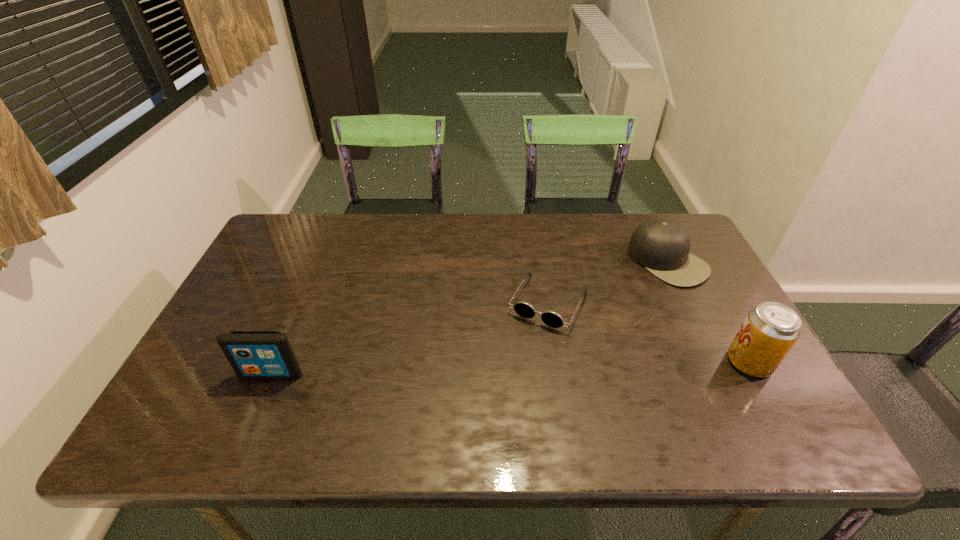
The width and height of the screenshot is (960, 540). Identify the location of the leftmost object. click(x=252, y=354).

The image size is (960, 540). In order to click on the second tallest object in this screenshot , I will do `click(252, 354)`.

Locate an element on the screen. This screenshot has width=960, height=540. pop (soda) is located at coordinates (770, 330).

In order to click on sunglasses in this screenshot , I will do `click(552, 319)`.

At what (x,y) coordinates should I click in order to perform the action: click on the second object from left to right. Please return your answer as a coordinate pair (x, y). This screenshot has height=540, width=960. Looking at the image, I should click on point(552,319).

Find the location of a particular element. This screenshot has width=960, height=540. the third tallest object is located at coordinates (662, 246).

You are a GUI agent. You are given a task and a screenshot of the screen. Output one action in this format:
    pyautogui.click(x=<x>, y=<y>)
    Task: Click on the vacant space located 0.060m on the front screen of the leftmost object
    Image resolution: width=960 pixels, height=540 pixels.
    Given the screenshot: What is the action you would take?
    pyautogui.click(x=259, y=403)

Locate an element on the screen. This screenshot has width=960, height=540. vacant space located 0.080m on the back of the pop (soda) is located at coordinates (727, 321).

Locate an element on the screen. Image resolution: width=960 pixels, height=540 pixels. blank space located on the front-facing side of the third object from right to left is located at coordinates (516, 365).

Where is `free location located 0.190m on the front-facing side of the third object from right to left`? The image size is (960, 540). free location located 0.190m on the front-facing side of the third object from right to left is located at coordinates (504, 387).